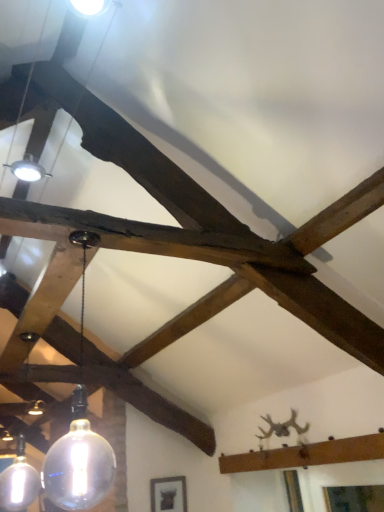
Question: Considering the relative sizes of matte black frame at lower center and transparent glass bulb at center, the 2th lamp from the back, in the image provided, is matte black frame at lower center taller than transparent glass bulb at center, the 2th lamp from the back,?

Choices:
 (A) no
 (B) yes

Answer: (A)

Question: From the image's perspective, is matte black frame at lower center under transparent glass bulb at center, which is the 2th lamp from left to right?

Choices:
 (A) no
 (B) yes

Answer: (B)

Question: From the image's perspective, is matte black frame at lower center on transparent glass bulb at center, the first lamp in the front-to-back sequence?

Choices:
 (A) no
 (B) yes

Answer: (A)

Question: Does matte black frame at lower center have a greater width compared to transparent glass bulb at center, the 2th lamp from the back?

Choices:
 (A) no
 (B) yes

Answer: (A)

Question: Is matte black frame at lower center not inside transparent glass bulb at center, which is the 2th lamp from left to right?

Choices:
 (A) no
 (B) yes

Answer: (B)

Question: Does matte black frame at lower center have a lesser height compared to transparent glass bulb at center, which is the 2th lamp from left to right?

Choices:
 (A) no
 (B) yes

Answer: (B)

Question: Considering the relative positions of matte glass globe at lower left, the 1th lamp positioned from the back, and transparent glass bulb at center, the first lamp in the front-to-back sequence, in the image provided, is matte glass globe at lower left, the 1th lamp positioned from the back, to the right of transparent glass bulb at center, the first lamp in the front-to-back sequence, from the viewer's perspective?

Choices:
 (A) no
 (B) yes

Answer: (A)

Question: Are matte glass globe at lower left, which is the second lamp from right to left, and transparent glass bulb at center, the 2th lamp from the back, making contact?

Choices:
 (A) yes
 (B) no

Answer: (B)

Question: Considering the relative sizes of matte glass globe at lower left, positioned as the second lamp in front-to-back order, and transparent glass bulb at center, the first lamp in the front-to-back sequence, in the image provided, is matte glass globe at lower left, positioned as the second lamp in front-to-back order, thinner than transparent glass bulb at center, the first lamp in the front-to-back sequence,?

Choices:
 (A) no
 (B) yes

Answer: (A)

Question: Can you confirm if matte glass globe at lower left, positioned as the second lamp in front-to-back order, is smaller than transparent glass bulb at center, positioned as the first lamp in right-to-left order?

Choices:
 (A) yes
 (B) no

Answer: (A)

Question: Is matte glass globe at lower left, the 1th lamp positioned from the back, to the left of transparent glass bulb at center, the 2th lamp from the back, from the viewer's perspective?

Choices:
 (A) no
 (B) yes

Answer: (B)

Question: From a real-world perspective, is matte glass globe at lower left, the 1th lamp positioned from the back, positioned under transparent glass bulb at center, the 2th lamp from the back, based on gravity?

Choices:
 (A) no
 (B) yes

Answer: (B)

Question: Is matte black frame at lower center inside transparent glass bulb at center, positioned as the first lamp in right-to-left order?

Choices:
 (A) yes
 (B) no

Answer: (B)